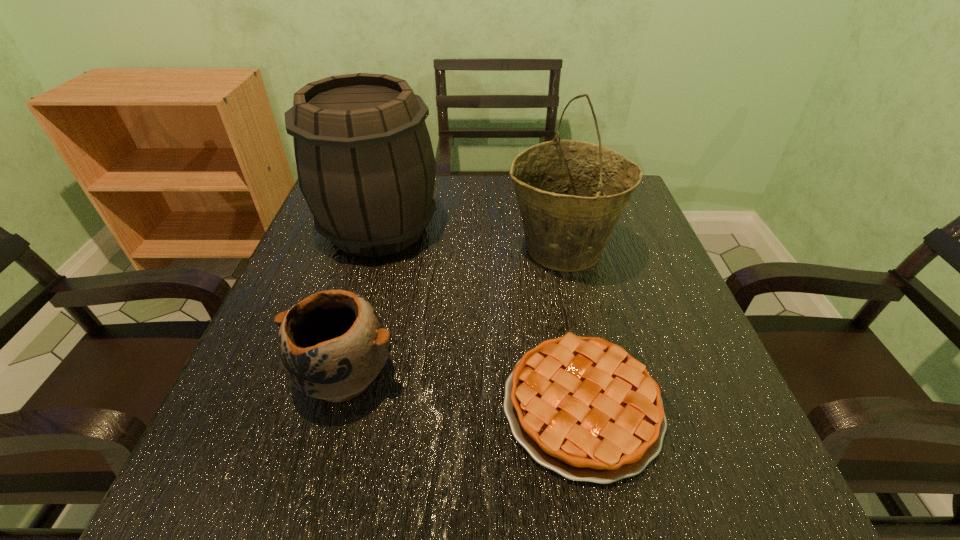
The width and height of the screenshot is (960, 540). Identify the location of vacant space that's between the pottery and the shortest object. (464, 390).

Where is `free area in between the right wine bucket and the left wine bucket`? free area in between the right wine bucket and the left wine bucket is located at coordinates (470, 239).

Image resolution: width=960 pixels, height=540 pixels. What are the coordinates of `vacant area between the right wine bucket and the pottery` in the screenshot? It's located at (454, 312).

Locate an element on the screen. vacant space that's between the right wine bucket and the pottery is located at coordinates (454, 312).

You are a GUI agent. You are given a task and a screenshot of the screen. Output one action in this format:
    pyautogui.click(x=<x>, y=<y>)
    Task: Click on the free space that is in between the right wine bucket and the left wine bucket
    
    Given the screenshot: What is the action you would take?
    pyautogui.click(x=470, y=239)

Where is `empty space between the right wine bucket and the pie`? The width and height of the screenshot is (960, 540). empty space between the right wine bucket and the pie is located at coordinates (572, 328).

This screenshot has width=960, height=540. Identify the location of free area in between the pie and the left wine bucket. (480, 317).

This screenshot has height=540, width=960. In order to click on vacant area that lies between the pottery and the shortest object in this screenshot , I will do pos(464,390).

This screenshot has height=540, width=960. I want to click on unoccupied position between the right wine bucket and the left wine bucket, so click(x=470, y=239).

The width and height of the screenshot is (960, 540). Identify the location of empty space that is in between the second shortest object and the right wine bucket. (454, 312).